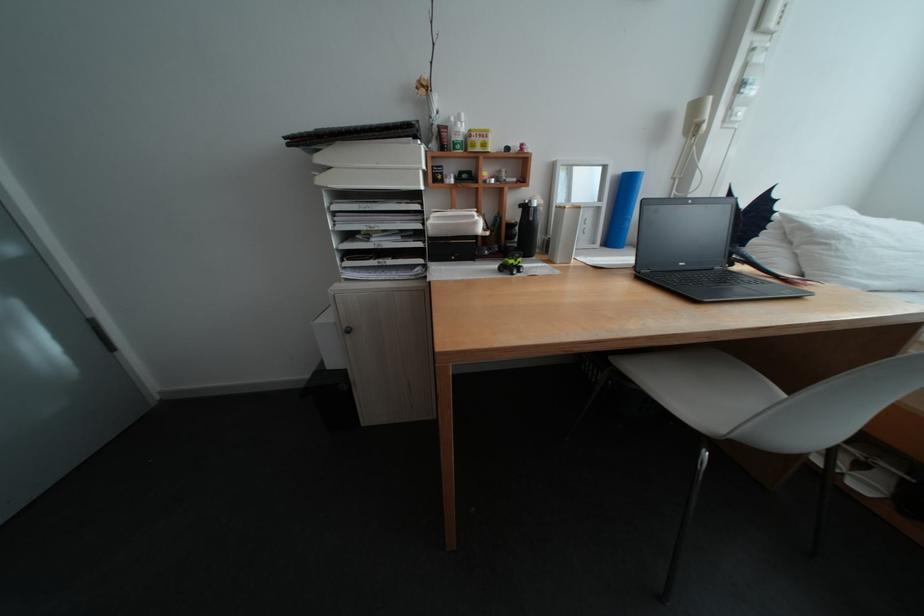
Find the location of a particular element. black bottle lid is located at coordinates (506, 148).